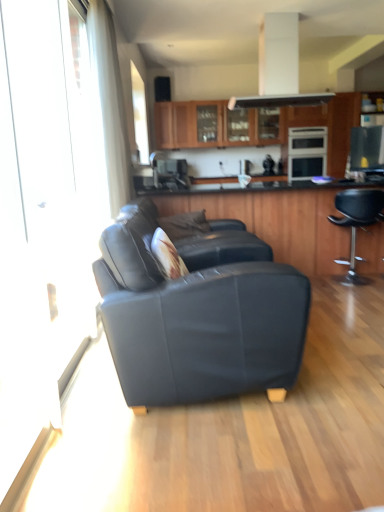
The width and height of the screenshot is (384, 512). In order to click on empty space that is to the right of matte black couch at center in this screenshot , I will do `click(339, 365)`.